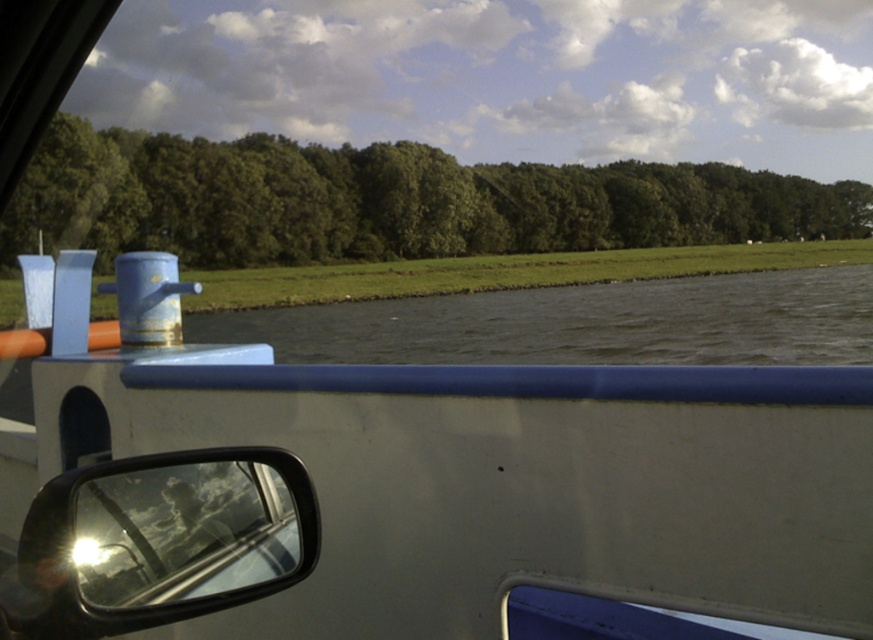
Is green leafy trees at upper center bigger than glossy plastic view mirror at lower left?

Yes.

Does green leafy trees at upper center have a greater height compared to glossy plastic view mirror at lower left?

Correct, green leafy trees at upper center is much taller as glossy plastic view mirror at lower left.

You are a GUI agent. You are given a task and a screenshot of the screen. Output one action in this format:
    pyautogui.click(x=<x>, y=<y>)
    Task: Click on the green leafy trees at upper center
    Image resolution: width=873 pixels, height=640 pixels.
    Given the screenshot: What is the action you would take?
    pyautogui.click(x=387, y=202)

You are a GUI agent. You are given a task and a screenshot of the screen. Output one action in this format:
    pyautogui.click(x=<x>, y=<y>)
    Task: Click on the green leafy trees at upper center
    Image resolution: width=873 pixels, height=640 pixels.
    Given the screenshot: What is the action you would take?
    pyautogui.click(x=387, y=202)

Between white matte boat at center and green leafy trees at upper center, which one is positioned higher?

green leafy trees at upper center

Is white matte boat at center wider than green leafy trees at upper center?

In fact, white matte boat at center might be narrower than green leafy trees at upper center.

Find the location of a particular element. The image size is (873, 640). white matte boat at center is located at coordinates (514, 481).

Based on the photo, who is higher up, white matte boat at center or glossy plastic view mirror at lower left?

glossy plastic view mirror at lower left is above.

Is white matte boat at center wider than glossy plastic view mirror at lower left?

Correct, the width of white matte boat at center exceeds that of glossy plastic view mirror at lower left.

Between point (610, 547) and point (234, 602), which one is positioned in front?

Positioned in front is point (234, 602).

The height and width of the screenshot is (640, 873). Identify the location of white matte boat at center. (514, 481).